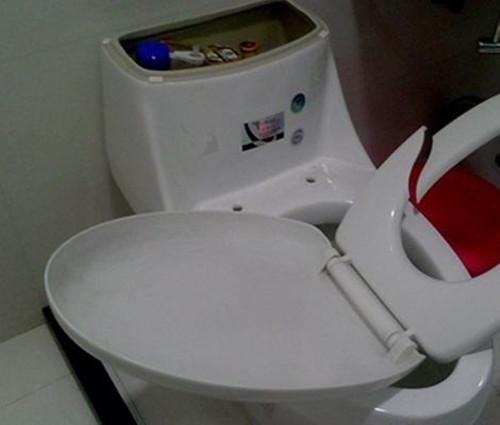
This screenshot has width=500, height=425. I want to click on broken toilet seat, so click(412, 155).